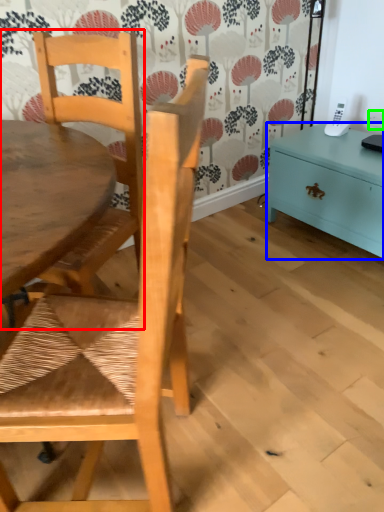
Question: Considering the real-world distances, which object is closest to chair (highlighted by a red box)? nightstand (highlighted by a blue box) or power outlet (highlighted by a green box).

Choices:
 (A) nightstand
 (B) power outlet

Answer: (A)